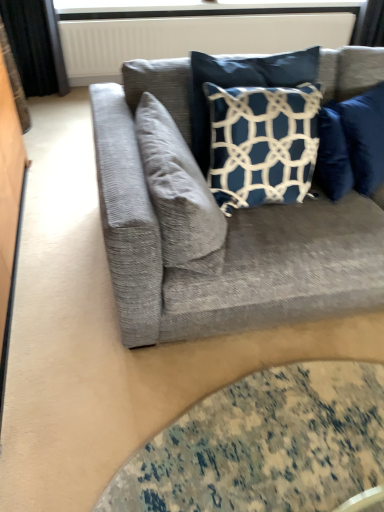
Question: Would you say white plastic window screen at upper center is outside white textured radiator at upper center?

Choices:
 (A) no
 (B) yes

Answer: (B)

Question: Is white textured radiator at upper center located within white plastic window screen at upper center?

Choices:
 (A) yes
 (B) no

Answer: (B)

Question: Considering the relative sizes of white plastic window screen at upper center and white textured radiator at upper center in the image provided, is white plastic window screen at upper center shorter than white textured radiator at upper center?

Choices:
 (A) no
 (B) yes

Answer: (B)

Question: Can you confirm if white plastic window screen at upper center is taller than white textured radiator at upper center?

Choices:
 (A) yes
 (B) no

Answer: (B)

Question: Considering the relative positions of white plastic window screen at upper center and white textured radiator at upper center in the image provided, is white plastic window screen at upper center in front of white textured radiator at upper center?

Choices:
 (A) yes
 (B) no

Answer: (B)

Question: Considering the relative positions of navy blue fabric pillow at upper right, which is counted as the second pillow, starting from the left, and black fabric curtain at left in the image provided, is navy blue fabric pillow at upper right, which is counted as the second pillow, starting from the left, to the left or to the right of black fabric curtain at left?

Choices:
 (A) right
 (B) left

Answer: (A)

Question: Would you say navy blue fabric pillow at upper right, marked as the first pillow in a right-to-left arrangement, is inside or outside black fabric curtain at left?

Choices:
 (A) inside
 (B) outside

Answer: (B)

Question: Looking at their shapes, would you say navy blue fabric pillow at upper right, which is counted as the second pillow, starting from the left, is wider or thinner than black fabric curtain at left?

Choices:
 (A) wide
 (B) thin

Answer: (B)

Question: In terms of size, does navy blue fabric pillow at upper right, which is counted as the second pillow, starting from the left, appear bigger or smaller than black fabric curtain at left?

Choices:
 (A) small
 (B) big

Answer: (A)

Question: Is point (81, 5) closer or farther from the camera than point (157, 88)?

Choices:
 (A) farther
 (B) closer

Answer: (A)

Question: Is white plastic window screen at upper center to the left or to the right of textured gray couch at center in the image?

Choices:
 (A) left
 (B) right

Answer: (A)

Question: Is white plastic window screen at upper center inside the boundaries of textured gray couch at center, or outside?

Choices:
 (A) inside
 (B) outside

Answer: (B)

Question: Is white plastic window screen at upper center taller or shorter than textured gray couch at center?

Choices:
 (A) short
 (B) tall

Answer: (A)

Question: Is point (145, 287) closer or farther from the camera than point (61, 10)?

Choices:
 (A) farther
 (B) closer

Answer: (B)

Question: Considering the positions of textured gray couch at center and white plastic window screen at upper center in the image, is textured gray couch at center wider or thinner than white plastic window screen at upper center?

Choices:
 (A) thin
 (B) wide

Answer: (B)